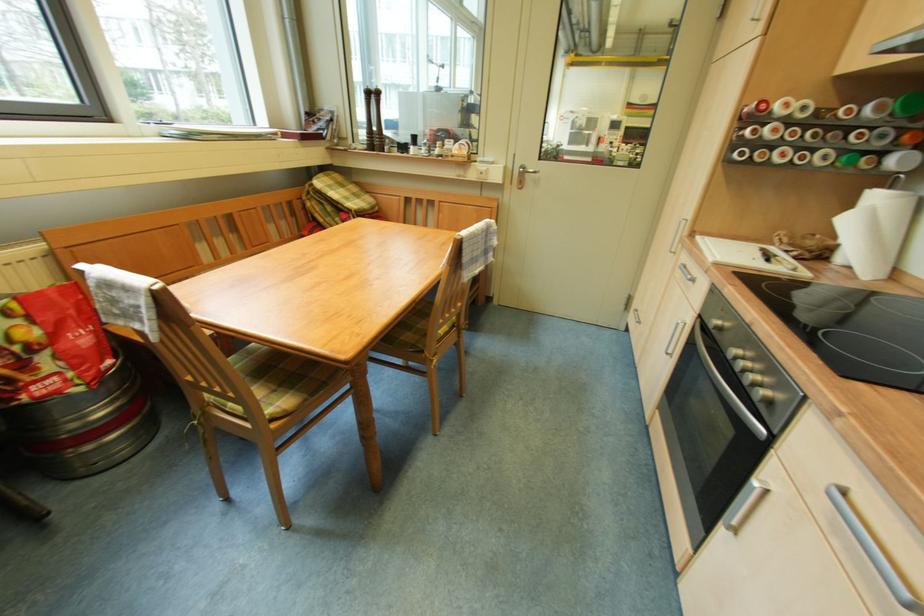
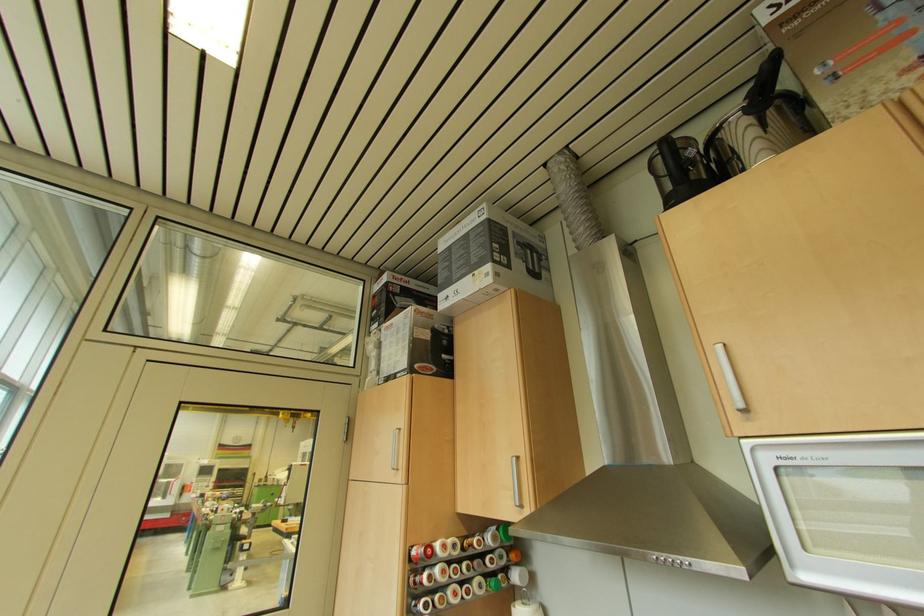
Find the pixel in the second image that matches the point at 629,152 in the first image.

(229, 513)